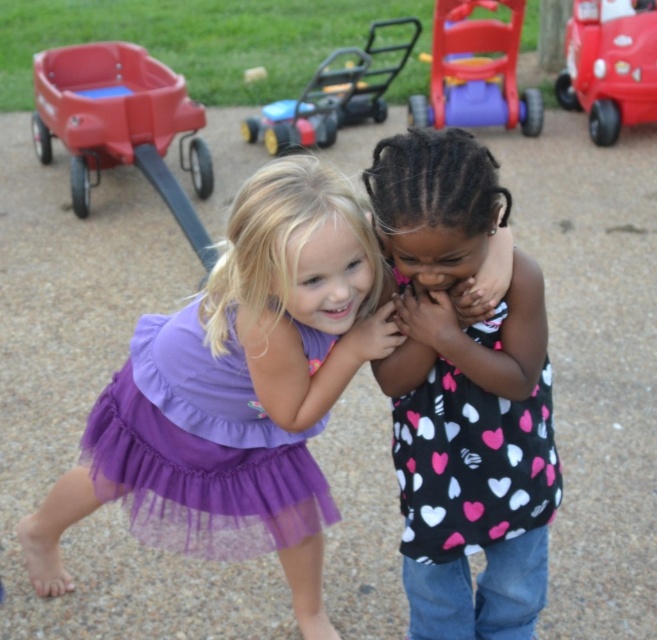
Is rubberized plastic walker at upper center to the right of black dotted shirt at center from the viewer's perspective?

Correct, you'll find rubberized plastic walker at upper center to the right of black dotted shirt at center.

Consider the image. Is rubberized plastic walker at upper center bigger than black dotted shirt at center?

Yes, rubberized plastic walker at upper center is bigger than black dotted shirt at center.

The image size is (657, 640). Find the location of `rubberized plastic walker at upper center`. rubberized plastic walker at upper center is located at coordinates (476, 70).

Does purple tulle skirt at center have a larger size compared to black dotted shirt at center?

Yes.

How far apart are purple tulle skirt at center and black dotted shirt at center?

21.85 inches

This screenshot has height=640, width=657. Find the location of `purple tulle skirt at center`. purple tulle skirt at center is located at coordinates (240, 384).

Measure the distance between point (459, 396) and camera.

A distance of 7.38 feet exists between point (459, 396) and camera.

Can you confirm if black polka dot tank top at center is positioned below matte plastic wagon at upper left?

Yes, black polka dot tank top at center is below matte plastic wagon at upper left.

Describe the element at coordinates (470, 464) in the screenshot. I see `black polka dot tank top at center` at that location.

The height and width of the screenshot is (640, 657). What are the coordinates of `black polka dot tank top at center` in the screenshot? It's located at (470, 464).